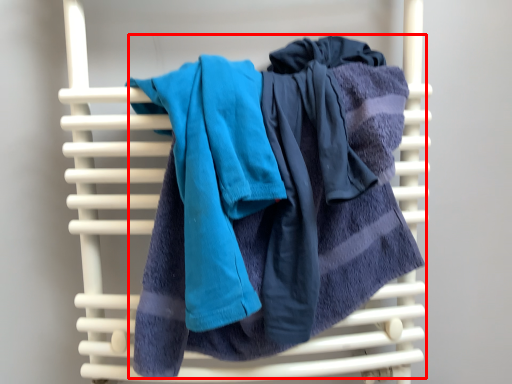
Question: In this image, where is towel (annotated by the red box) located relative to towel?

Choices:
 (A) left
 (B) right

Answer: (B)